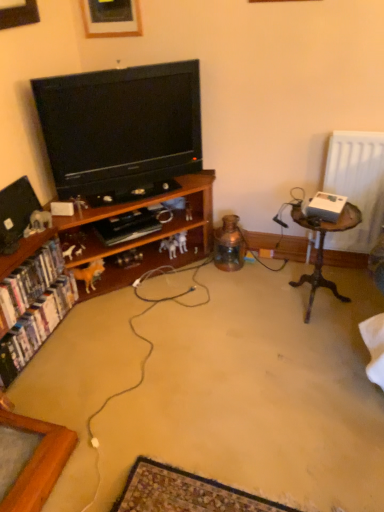
What do you see at coordinates (29, 282) in the screenshot? I see `white glossy bookshelf at left, the 1th book from the top` at bounding box center [29, 282].

Describe the element at coordinates (323, 249) in the screenshot. The width and height of the screenshot is (384, 512). I see `woodenobject at right` at that location.

Where is `wooden cabinet at left`? This screenshot has width=384, height=512. wooden cabinet at left is located at coordinates click(x=107, y=261).

Measure the distance between point [32,260] and camera.

A distance of 1.93 meters exists between point [32,260] and camera.

The width and height of the screenshot is (384, 512). Describe the element at coordinates (16, 213) in the screenshot. I see `matte black television at left, the second television from the right` at that location.

Where is `white glossy bookshelf at left, acting as the second book starting from the bottom`? Image resolution: width=384 pixels, height=512 pixels. white glossy bookshelf at left, acting as the second book starting from the bottom is located at coordinates (29, 282).

Is white glossy bookshelf at lower left, which is the second book in top-to-bottom order, placed right next to wooden cabinet at left?

No, white glossy bookshelf at lower left, which is the second book in top-to-bottom order, is not with wooden cabinet at left.

Could you tell me if white glossy bookshelf at lower left, the first book in the bottom-to-top sequence, is turned towards wooden cabinet at left?

Yes, white glossy bookshelf at lower left, the first book in the bottom-to-top sequence, is facing wooden cabinet at left.

Looking at this image, does white glossy bookshelf at lower left, the first book in the bottom-to-top sequence, appear on the left side of wooden cabinet at left?

Correct, you'll find white glossy bookshelf at lower left, the first book in the bottom-to-top sequence, to the left of wooden cabinet at left.

From a real-world perspective, is white glossy bookshelf at lower left, which is the second book in top-to-bottom order, above or below wooden cabinet at left?

In terms of real-world spatial position, white glossy bookshelf at lower left, which is the second book in top-to-bottom order, is below wooden cabinet at left.

Is white glossy bookshelf at left, the 1th book from the top, facing away from woodenobject at right?

No, white glossy bookshelf at left, the 1th book from the top, is not facing the opposite direction of woodenobject at right.

Which object is thinner, white glossy bookshelf at left, the 1th book from the top, or woodenobject at right?

white glossy bookshelf at left, the 1th book from the top, is thinner.

From the picture: In the image, is white glossy bookshelf at left, acting as the second book starting from the bottom, on the left side or the right side of woodenobject at right?

white glossy bookshelf at left, acting as the second book starting from the bottom, is to the left of woodenobject at right.

Looking at this image, how many degrees apart are the facing directions of white glossy bookshelf at left, the 1th book from the top, and black glossy television at center, the 2th television from the left?

Answer: 49.9 degrees.

Find the location of a particular element. The width and height of the screenshot is (384, 512). book that is the 1st one below the black glossy television at center, which ranks as the 1th television in right-to-left order (from a real-world perspective) is located at coordinates (29, 282).

Considering the sizes of objects white glossy bookshelf at left, acting as the second book starting from the bottom, and black glossy television at center, which ranks as the 1th television in right-to-left order, in the image provided, who is smaller, white glossy bookshelf at left, acting as the second book starting from the bottom, or black glossy television at center, which ranks as the 1th television in right-to-left order,?

white glossy bookshelf at left, acting as the second book starting from the bottom.

From a real-world perspective, is white glossy bookshelf at left, acting as the second book starting from the bottom, physically below black glossy television at center, which ranks as the 1th television in right-to-left order?

Yes, from a real-world perspective, white glossy bookshelf at left, acting as the second book starting from the bottom, is below black glossy television at center, which ranks as the 1th television in right-to-left order.

From a real-world perspective, is black glossy television at center, which ranks as the 1th television in right-to-left order, positioned above or below wooden picture frame at upper center?

Clearly, from a real-world perspective, black glossy television at center, which ranks as the 1th television in right-to-left order, is below wooden picture frame at upper center.

Is black glossy television at center, the 2th television from the left, far away from wooden picture frame at upper center?

Actually, black glossy television at center, the 2th television from the left, and wooden picture frame at upper center are a little close together.

Consider the image. From the image's perspective, which object appears higher, black glossy television at center, the 2th television from the left, or wooden picture frame at upper center?

wooden picture frame at upper center, from the image's perspective.

Would you say black glossy television at center, the 2th television from the left, is inside or outside wooden picture frame at upper center?

black glossy television at center, the 2th television from the left, lies outside wooden picture frame at upper center.

Is the position of white glossy bookshelf at left, the 1th book from the top, less distant than that of white glossy bookshelf at lower left, which is the second book in top-to-bottom order?

Yes, white glossy bookshelf at left, the 1th book from the top, is closer to the viewer.

Looking at this image, which object is positioned more to the right, white glossy bookshelf at left, the 1th book from the top, or white glossy bookshelf at lower left, which is the second book in top-to-bottom order?

From the viewer's perspective, white glossy bookshelf at lower left, which is the second book in top-to-bottom order, appears more on the right side.

Could you tell me if white glossy bookshelf at left, the 1th book from the top, is turned towards white glossy bookshelf at lower left, the first book in the bottom-to-top sequence?

No, white glossy bookshelf at left, the 1th book from the top, is not aimed at white glossy bookshelf at lower left, the first book in the bottom-to-top sequence.

From a real-world perspective, which object rests below the other?

white glossy bookshelf at lower left, which is the second book in top-to-bottom order, is physically lower.

Is woodenobject at right thinner than black glossy television at center, which ranks as the 1th television in right-to-left order?

No, woodenobject at right is not thinner than black glossy television at center, which ranks as the 1th television in right-to-left order.

Is woodenobject at right turned away from black glossy television at center, the 2th television from the left?

No, black glossy television at center, the 2th television from the left, is not at the back of woodenobject at right.

From the image's perspective, which one is positioned lower, woodenobject at right or black glossy television at center, the 2th television from the left?

woodenobject at right is shown below in the image.

Do you think woodenobject at right is within black glossy television at center, which ranks as the 1th television in right-to-left order, or outside of it?

woodenobject at right cannot be found inside black glossy television at center, which ranks as the 1th television in right-to-left order.

How many degrees apart are the facing directions of wooden picture frame at upper center and wooden cabinet at left?

The facing directions of wooden picture frame at upper center and wooden cabinet at left are 93.7 degrees apart.

From the picture: From a real-world perspective, is wooden picture frame at upper center physically above wooden cabinet at left?

Yes, from a real-world perspective, wooden picture frame at upper center is above wooden cabinet at left.

Is wooden picture frame at upper center positioned in front of wooden cabinet at left?

No, wooden picture frame at upper center is further to the viewer.

Between wooden picture frame at upper center and wooden cabinet at left, which one has smaller size?

Smaller between the two is wooden picture frame at upper center.

I want to click on cabinetry that appears above the white glossy bookshelf at lower left, which is the second book in top-to-bottom order (from the image's perspective), so click(x=107, y=261).

Image resolution: width=384 pixels, height=512 pixels. Identify the location of table beneath the white glossy bookshelf at left, acting as the second book starting from the bottom (from a real-world perspective). (323, 249).

When comparing their distances from matte black television at left, positioned as the 1th television in left-to-right order, does black glossy television at center, the 2th television from the left, or white glossy bookshelf at lower left, the first book in the bottom-to-top sequence, seem further?

black glossy television at center, the 2th television from the left, is further to matte black television at left, positioned as the 1th television in left-to-right order.

Estimate the real-world distances between objects in this image. Which object is further from black glossy television at center, the 2th television from the left, woodenobject at right or white glossy bookshelf at lower left, which is the second book in top-to-bottom order?

woodenobject at right is further to black glossy television at center, the 2th television from the left.

From the image, which object appears to be nearer to white glossy bookshelf at lower left, the first book in the bottom-to-top sequence, wooden picture frame at upper center or black glossy television at center, the 2th television from the left?

black glossy television at center, the 2th television from the left, lies closer to white glossy bookshelf at lower left, the first book in the bottom-to-top sequence, than the other object.

From the image, which object appears to be farther from black glossy television at center, the 2th television from the left, matte black television at left, the second television from the right, or white glossy bookshelf at left, the 1th book from the top?

Based on the image, white glossy bookshelf at left, the 1th book from the top, appears to be further to black glossy television at center, the 2th television from the left.

From the image, which object appears to be farther from wooden cabinet at left, matte black television at left, positioned as the 1th television in left-to-right order, or wooden picture frame at upper center?

Among the two, wooden picture frame at upper center is located further to wooden cabinet at left.

From the image, which object appears to be nearer to white glossy bookshelf at lower left, the first book in the bottom-to-top sequence, matte black television at left, positioned as the 1th television in left-to-right order, or woodenobject at right?

matte black television at left, positioned as the 1th television in left-to-right order.

Considering their positions, is wooden picture frame at upper center positioned further to black glossy television at center, the 2th television from the left, than white glossy bookshelf at left, the 1th book from the top?

The object further to black glossy television at center, the 2th television from the left, is white glossy bookshelf at left, the 1th book from the top.

When comparing their distances from white glossy bookshelf at left, the 1th book from the top, does white glossy bookshelf at lower left, which is the second book in top-to-bottom order, or wooden cabinet at left seem closer?

Based on the image, white glossy bookshelf at lower left, which is the second book in top-to-bottom order, appears to be nearer to white glossy bookshelf at left, the 1th book from the top.

I want to click on cabinetry situated between matte black television at left, the second television from the right, and woodenobject at right from left to right, so click(x=107, y=261).

Find the location of `television between white glossy bookshelf at lower left, the first book in the bottom-to-top sequence, and woodenobject at right from left to right`. television between white glossy bookshelf at lower left, the first book in the bottom-to-top sequence, and woodenobject at right from left to right is located at coordinates (120, 128).

The image size is (384, 512). What are the coordinates of `television between white glossy bookshelf at left, the 1th book from the top, and woodenobject at right from left to right` in the screenshot? It's located at (120, 128).

Locate an element on the screen. Image resolution: width=384 pixels, height=512 pixels. picture frame located between matte black television at left, positioned as the 1th television in left-to-right order, and woodenobject at right in the left-right direction is located at coordinates (111, 18).